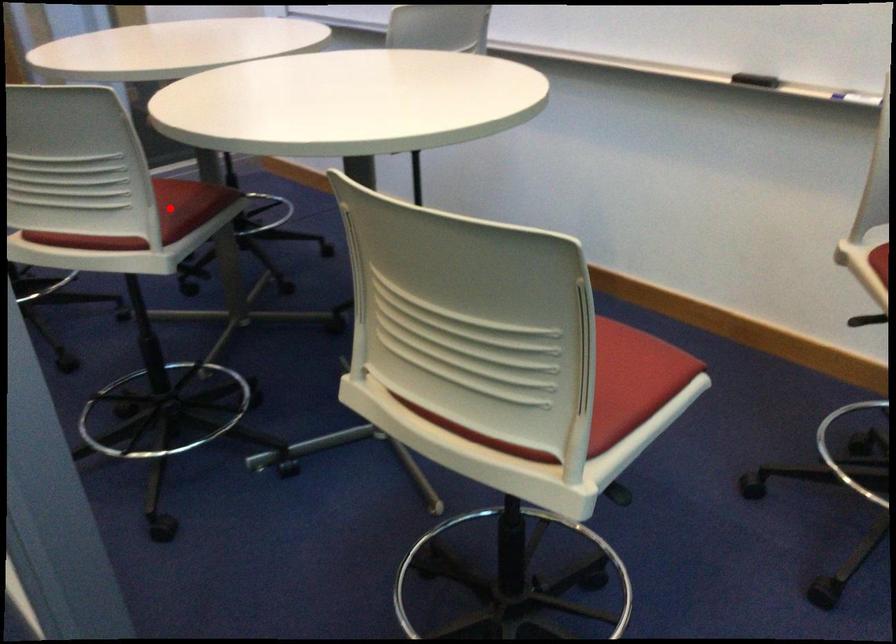
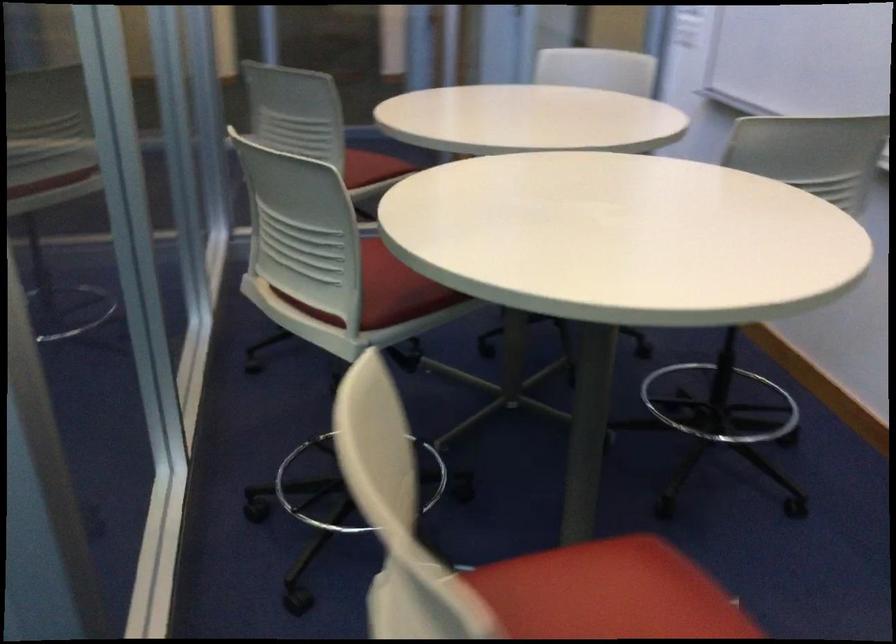
Where in the second image is the point corresponding to the highlighted location from the first image?

(397, 289)